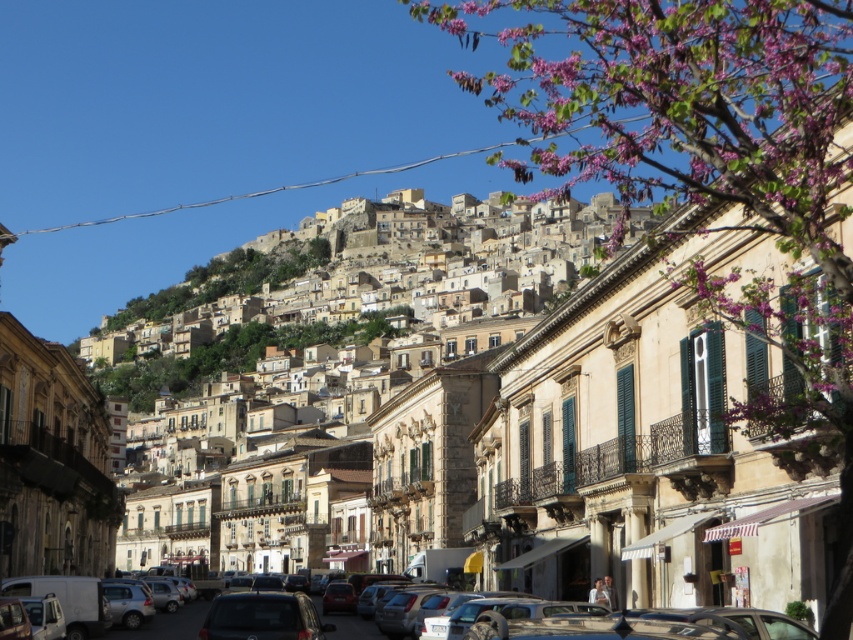
Based on the photo, who is more distant from viewer, (x=146, y=422) or (x=325, y=609)?

The point (x=146, y=422) is behind.

Is beige stone buildings at center further to the viewer compared to matte silver car at lower center?

Yes, it is.

Between point (337, 396) and point (741, 618), which one is positioned behind?

Point (337, 396)

Where is `beige stone buildings at center`? beige stone buildings at center is located at coordinates (413, 339).

The width and height of the screenshot is (853, 640). What are the coordinates of `beige stone buildings at center` in the screenshot? It's located at (413, 339).

Is beige stone buildings at center to the right of dark gray metallic car at center from the viewer's perspective?

No, beige stone buildings at center is not to the right of dark gray metallic car at center.

Does point (416, 481) come behind point (265, 592)?

That is True.

Identify the location of beige stone buildings at center. Image resolution: width=853 pixels, height=640 pixels. (413, 339).

Is dark gray metallic car at center thinner than matte silver car at lower center?

Correct, dark gray metallic car at center's width is less than matte silver car at lower center's.

Is dark gray metallic car at center further to camera compared to matte silver car at lower center?

Yes, it is.

Is point (242, 611) in front of point (202, 586)?

Yes.

The width and height of the screenshot is (853, 640). Identify the location of dark gray metallic car at center. (262, 618).